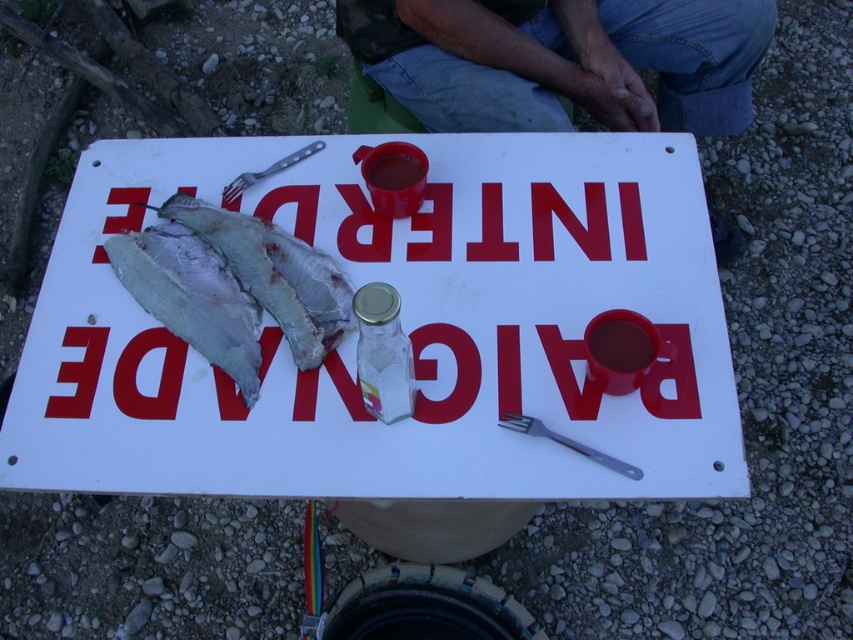
Who is more distant from viewer, (108, 204) or (576, 442)?

Positioned behind is point (108, 204).

Locate an element on the screen. Image resolution: width=853 pixels, height=640 pixels. white plastic sign at center is located at coordinates (403, 328).

Is point (537, 97) positioned before point (312, 150)?

No, it is not.

I want to click on jeans at upper center, so click(x=561, y=60).

Identify the location of jeans at upper center. (561, 60).

Is white plastic sign at center smaller than silver metallic fork at upper left?

No.

Who is shorter, white plastic sign at center or silver metallic fork at upper left?

silver metallic fork at upper left is shorter.

Who is more forward, [184,358] or [241,179]?

Point [184,358]

Locate an element on the screen. The width and height of the screenshot is (853, 640). white plastic sign at center is located at coordinates pyautogui.click(x=403, y=328).